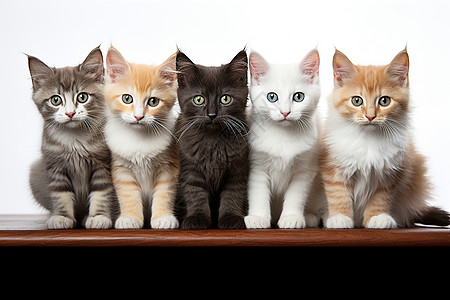
This screenshot has width=450, height=300. Find the location of `chest`. chest is located at coordinates pyautogui.click(x=74, y=151), pyautogui.click(x=141, y=152), pyautogui.click(x=215, y=154), pyautogui.click(x=281, y=149), pyautogui.click(x=368, y=147).